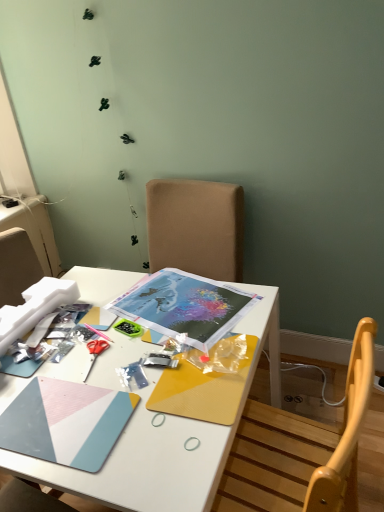
Where is `vacant area situated to the left side of red plastic scissors at center-left`? vacant area situated to the left side of red plastic scissors at center-left is located at coordinates (40, 370).